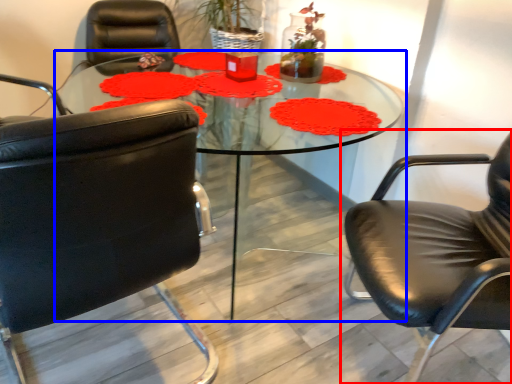
Question: Among these objects, which one is farthest to the camera, chair (highlighted by a red box) or coffee table (highlighted by a blue box)?

Choices:
 (A) chair
 (B) coffee table

Answer: (B)